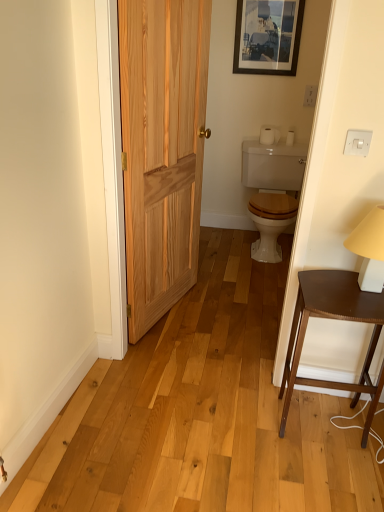
Locate an element on the screen. This screenshot has width=384, height=512. vacant space underneath dark brown wood table at right (from a real-world perspective) is located at coordinates (324, 423).